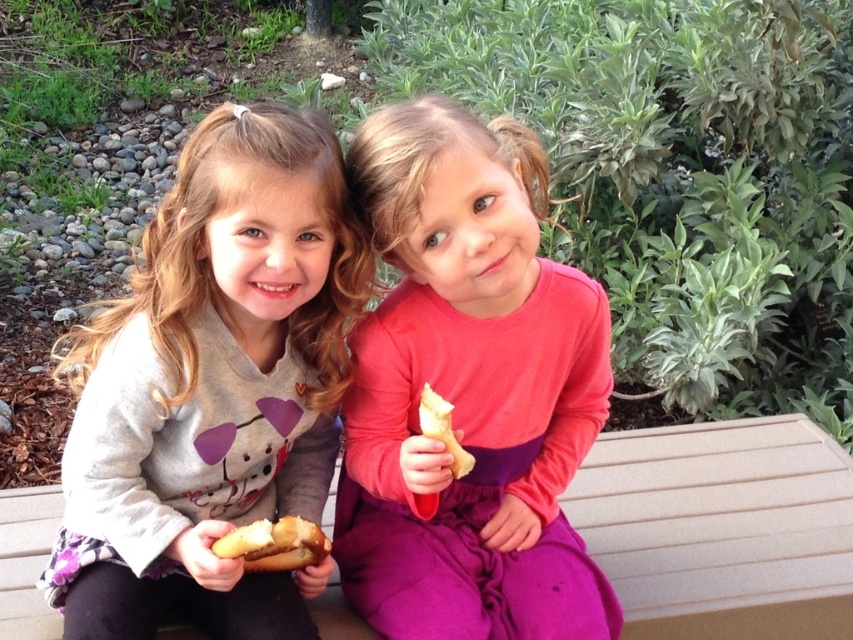
You are a photographer setting up a shoot in the scene described. You need to ensure that both the matte pink dress at center and the yellowish bread at center are clearly visible in the photo. Given their sizes, which object should you focus on first to ensure proper focus?

The matte pink dress at center is much taller than the yellowish bread at center, so you should focus on the matte pink dress at center first to ensure proper focus.

You are a photographer trying to capture a closeup of the yellowish bread at center without the matte pink dress at center blocking the shot. Based on their widths, which object should you adjust your camera angle to focus on first?

The matte pink dress at center is wider than the yellowish bread at center, so you should adjust your camera angle to focus on the matte pink dress at center first to ensure it doesn not block the yellowish bread at center.